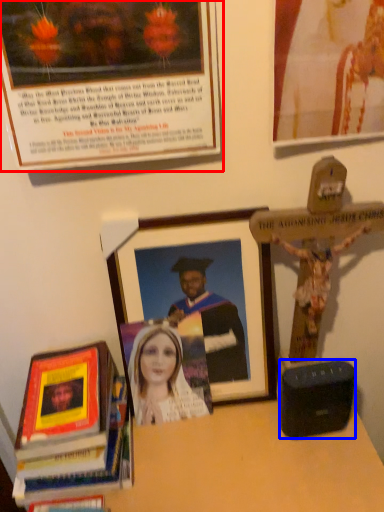
Question: Among these objects, which one is farthest to the camera, picture frame (highlighted by a red box) or speaker (highlighted by a blue box)?

Choices:
 (A) picture frame
 (B) speaker

Answer: (B)